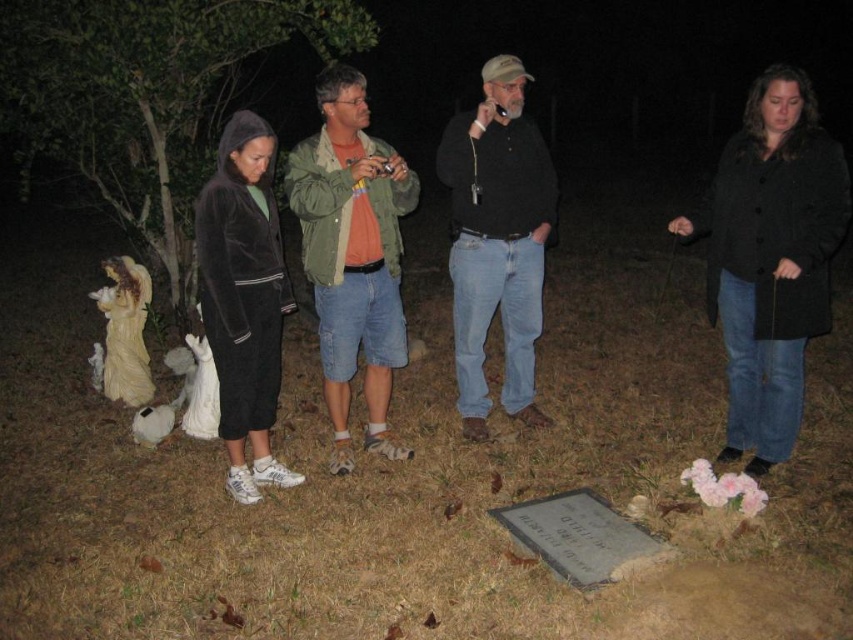
Question: Can you confirm if black wool coat at right is positioned below green-cotton jacket at center?

Choices:
 (A) no
 (B) yes

Answer: (B)

Question: Which of the following is the farthest from the observer?

Choices:
 (A) (239, 493)
 (B) (103, 150)
 (C) (396, 177)
 (D) (793, 332)

Answer: (B)

Question: Which object is closer to the camera taking this photo?

Choices:
 (A) black matte shirt at center
 (B) black wool coat at right
 (C) green-cotton jacket at center
 (D) green leafy tree at left

Answer: (B)

Question: From the image, what is the correct spatial relationship of green leafy tree at left in relation to black matte shirt at center?

Choices:
 (A) above
 (B) below

Answer: (A)

Question: Among these points, which one is farthest from the camera?

Choices:
 (A) (320, 333)
 (B) (230, 44)
 (C) (746, 289)

Answer: (B)

Question: Is green leafy tree at left smaller than velvety black coat at center?

Choices:
 (A) yes
 (B) no

Answer: (B)